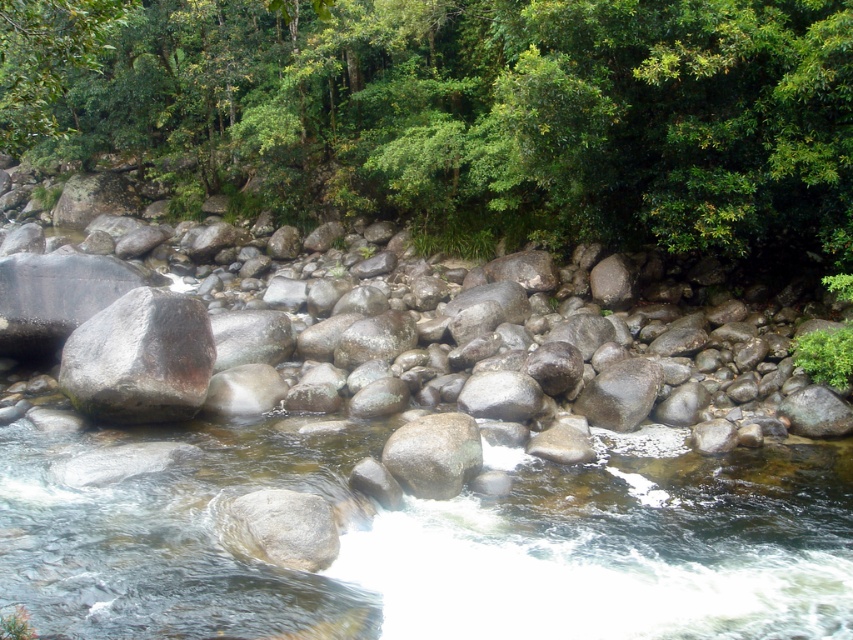
Question: Which object is the farthest from the smooth gray rock at center-right?

Choices:
 (A) green leafy tree at upper center
 (B) gray smooth rock at center
 (C) gray rough rock at left

Answer: (A)

Question: Which point is farther from the camera taking this photo?

Choices:
 (A) (175, 307)
 (B) (802, 186)
 (C) (407, 444)
 (D) (641, 417)

Answer: (B)

Question: Can you confirm if green leafy tree at upper center is positioned below gray rough rock at left?

Choices:
 (A) no
 (B) yes

Answer: (A)

Question: Can you confirm if gray smooth rock at center is thinner than smooth gray rock at center-right?

Choices:
 (A) no
 (B) yes

Answer: (B)

Question: Observing the image, what is the correct spatial positioning of green leafy tree at upper center in reference to gray smooth rock at center?

Choices:
 (A) above
 (B) below

Answer: (A)

Question: Which object is positioned closest to the smooth gray rock at center-right?

Choices:
 (A) green leafy tree at upper center
 (B) gray smooth rock at center
 (C) gray rough rock at left
 (D) gray rough rock at center

Answer: (D)